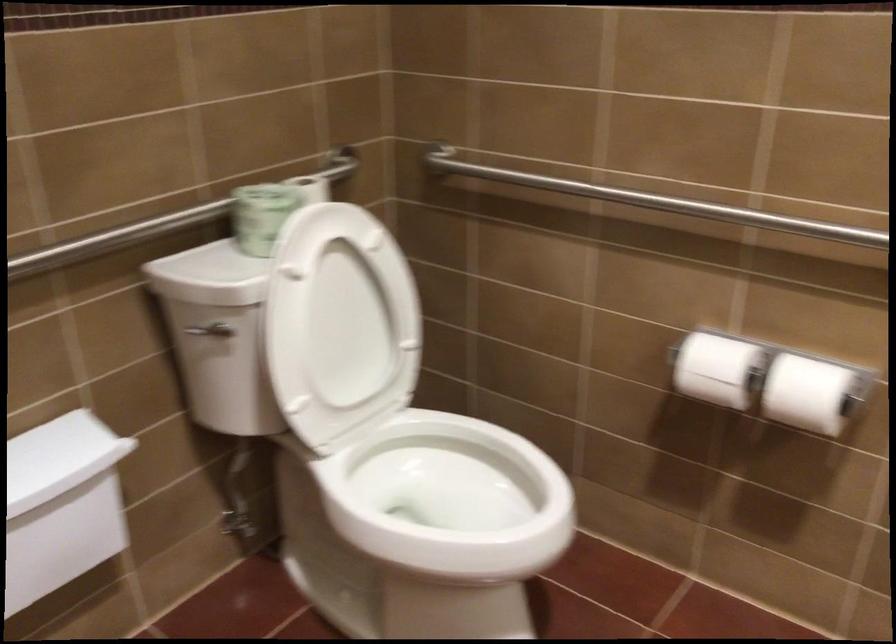
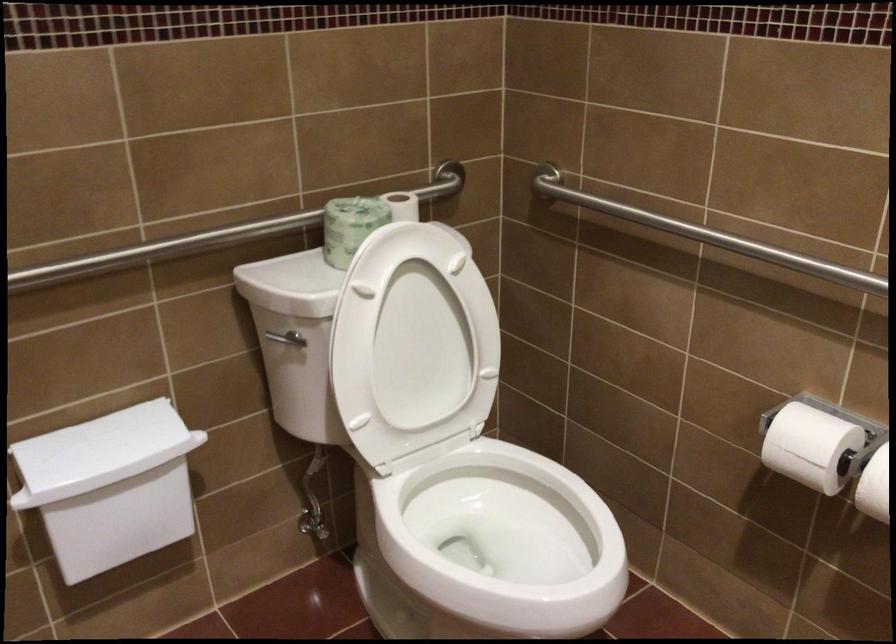
Locate, in the second image, the point that corresponds to pixel 264 212 in the first image.

(350, 225)